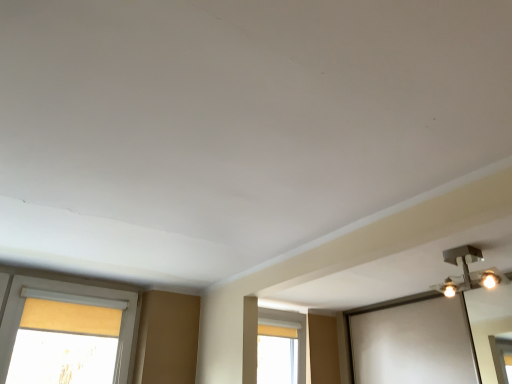
Where is `metallic silver light fixture at upper right`? The height and width of the screenshot is (384, 512). metallic silver light fixture at upper right is located at coordinates (468, 272).

Measure the distance between metallic silver light fixture at upper right and camera.

metallic silver light fixture at upper right is 2.19 meters away from camera.

Describe the element at coordinates (468, 272) in the screenshot. I see `metallic silver light fixture at upper right` at that location.

The width and height of the screenshot is (512, 384). I want to click on matte yellow curtain at center, so click(281, 349).

This screenshot has width=512, height=384. What do you see at coordinates (281, 349) in the screenshot?
I see `matte yellow curtain at center` at bounding box center [281, 349].

What is the approximate height of matte yellow curtain at center?

It is 24.12 inches.

Measure the distance between matte yellow curtain at center and camera.

matte yellow curtain at center is 3.28 meters from camera.

I want to click on metallic silver light fixture at upper right, so click(x=468, y=272).

Does matte yellow curtain at center appear on the right side of metallic silver light fixture at upper right?

No, matte yellow curtain at center is not to the right of metallic silver light fixture at upper right.

Relative to metallic silver light fixture at upper right, is matte yellow curtain at center in front or behind?

matte yellow curtain at center is behind metallic silver light fixture at upper right.

Is point (286, 379) closer or farther from the camera than point (466, 255)?

Clearly, point (286, 379) is more distant from the camera than point (466, 255).

From the image's perspective, does matte yellow curtain at center appear lower than metallic silver light fixture at upper right?

Yes, from the image's perspective, matte yellow curtain at center is beneath metallic silver light fixture at upper right.

From a real-world perspective, is matte yellow curtain at center on top of metallic silver light fixture at upper right?

No, from a real-world perspective, matte yellow curtain at center is not on top of metallic silver light fixture at upper right.

Is matte yellow curtain at center wider or thinner than metallic silver light fixture at upper right?

Clearly, matte yellow curtain at center has less width compared to metallic silver light fixture at upper right.

Between matte yellow curtain at center and metallic silver light fixture at upper right, which one has more height?

matte yellow curtain at center.

Who is bigger, matte yellow curtain at center or metallic silver light fixture at upper right?

matte yellow curtain at center is bigger.

Can we say matte yellow curtain at center lies outside metallic silver light fixture at upper right?

Indeed, matte yellow curtain at center is completely outside metallic silver light fixture at upper right.

Looking at this image, is matte yellow curtain at center next to metallic silver light fixture at upper right?

No, matte yellow curtain at center is not next to metallic silver light fixture at upper right.

Is matte yellow curtain at center oriented away from metallic silver light fixture at upper right?

That's not correct — matte yellow curtain at center is not looking away from metallic silver light fixture at upper right.

What's the angular difference between matte yellow curtain at center and metallic silver light fixture at upper right's facing directions?

The angular difference between matte yellow curtain at center and metallic silver light fixture at upper right is 1.01 degrees.

You are a GUI agent. You are given a task and a screenshot of the screen. Output one action in this format:
    pyautogui.click(x=<x>, y=<y>)
    Task: Click on the light fixture above the matte yellow curtain at center (from the image's perspective)
    
    Given the screenshot: What is the action you would take?
    pyautogui.click(x=468, y=272)

Can you confirm if metallic silver light fixture at upper right is positioned to the right of matte yellow curtain at center?

Indeed, metallic silver light fixture at upper right is positioned on the right side of matte yellow curtain at center.

Which is in front, metallic silver light fixture at upper right or matte yellow curtain at center?

metallic silver light fixture at upper right is closer to the camera.

Which is behind, point (480, 253) or point (263, 315)?

The point (263, 315) is farther from the camera.

From the image's perspective, which is above, metallic silver light fixture at upper right or matte yellow curtain at center?

metallic silver light fixture at upper right, from the image's perspective.

From a real-world perspective, who is located higher, metallic silver light fixture at upper right or matte yellow curtain at center?

metallic silver light fixture at upper right is physically above.

Considering the sizes of metallic silver light fixture at upper right and matte yellow curtain at center in the image, is metallic silver light fixture at upper right wider or thinner than matte yellow curtain at center?

metallic silver light fixture at upper right is wider than matte yellow curtain at center.

From their relative heights in the image, would you say metallic silver light fixture at upper right is taller or shorter than matte yellow curtain at center?

Considering their sizes, metallic silver light fixture at upper right has less height than matte yellow curtain at center.

Considering the relative sizes of metallic silver light fixture at upper right and matte yellow curtain at center in the image provided, is metallic silver light fixture at upper right bigger than matte yellow curtain at center?

No, metallic silver light fixture at upper right is not bigger than matte yellow curtain at center.

Would you say metallic silver light fixture at upper right contains matte yellow curtain at center?

No, matte yellow curtain at center is not inside metallic silver light fixture at upper right.

Is metallic silver light fixture at upper right next to matte yellow curtain at center?

No, metallic silver light fixture at upper right is not next to matte yellow curtain at center.

Could you tell me if metallic silver light fixture at upper right is facing matte yellow curtain at center?

No, metallic silver light fixture at upper right is not oriented towards matte yellow curtain at center.

Can you tell me how much metallic silver light fixture at upper right and matte yellow curtain at center differ in facing direction?

They differ by 1.01 degrees in their facing directions.

Image resolution: width=512 pixels, height=384 pixels. Find the location of `light fixture positioned vertically above the matte yellow curtain at center (from a real-world perspective)`. light fixture positioned vertically above the matte yellow curtain at center (from a real-world perspective) is located at coordinates (468, 272).

I want to click on light fixture that appears above the matte yellow curtain at center (from a real-world perspective), so click(468, 272).

This screenshot has width=512, height=384. Identify the location of window below the metallic silver light fixture at upper right (from a real-world perspective). click(x=281, y=349).